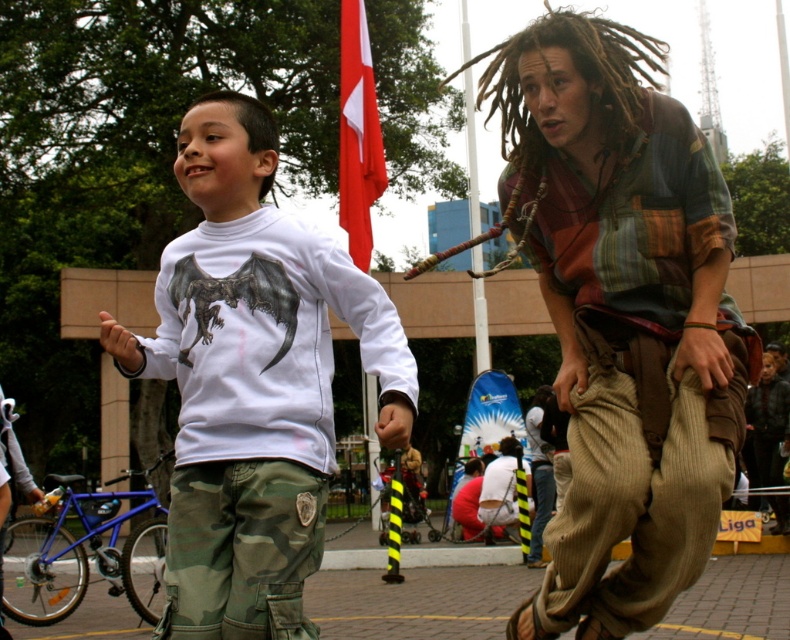
Between point (593, 465) and point (768, 476), which one is positioned in front?

Point (593, 465)

Is point (641, 260) more distant than point (781, 508)?

No, (641, 260) is closer to viewer.

Find the location of a particular element. multicolored patchwork shirt at center is located at coordinates (623, 317).

Is white matte shirt at center smaller than red fabric flag at upper center?

No.

Is white matte shirt at center wider than red fabric flag at upper center?

Correct, the width of white matte shirt at center exceeds that of red fabric flag at upper center.

Does point (134, 372) come closer to viewer compared to point (345, 141)?

Yes, point (134, 372) is in front of point (345, 141).

Locate an element on the screen. The width and height of the screenshot is (790, 640). white matte shirt at center is located at coordinates (251, 380).

Does multicolored patchwork shirt at center have a greater width compared to brown corduroy pants at center?

Correct, the width of multicolored patchwork shirt at center exceeds that of brown corduroy pants at center.

Between multicolored patchwork shirt at center and brown corduroy pants at center, which one appears on the left side from the viewer's perspective?

From the viewer's perspective, multicolored patchwork shirt at center appears more on the left side.

Between point (632, 394) and point (508, 444), which one is positioned behind?

The point (508, 444) is more distant.

You are a GUI agent. You are given a task and a screenshot of the screen. Output one action in this format:
    pyautogui.click(x=<x>, y=<y>)
    Task: Click on the multicolored patchwork shirt at center
    This screenshot has height=640, width=790.
    Given the screenshot: What is the action you would take?
    pyautogui.click(x=623, y=317)